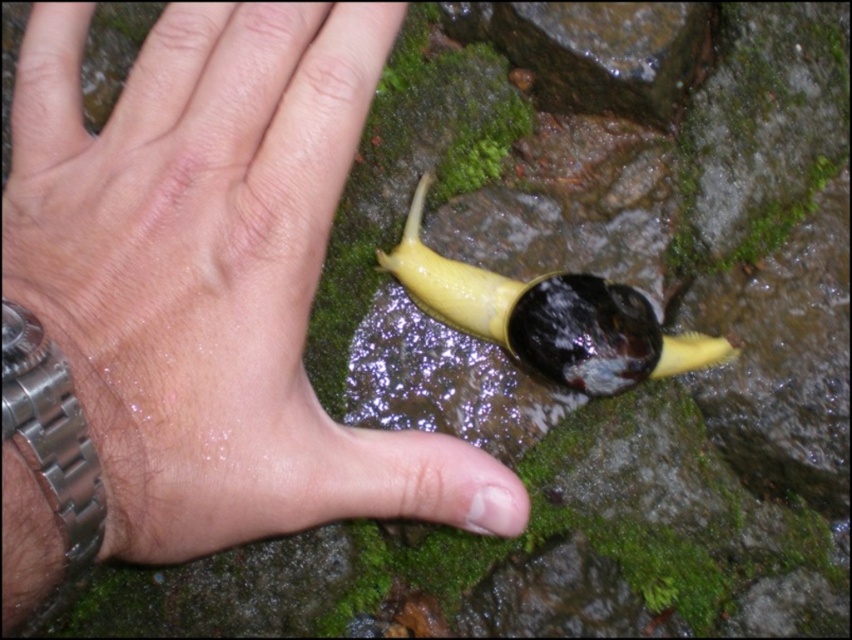
Does skinny silver watch at lower left appear on the left side of yellow rubber snail at center?

Indeed, skinny silver watch at lower left is positioned on the left side of yellow rubber snail at center.

What do you see at coordinates (213, 275) in the screenshot? The height and width of the screenshot is (640, 852). I see `skinny silver watch at lower left` at bounding box center [213, 275].

This screenshot has height=640, width=852. I want to click on skinny silver watch at lower left, so click(x=213, y=275).

I want to click on skinny silver watch at lower left, so (x=213, y=275).